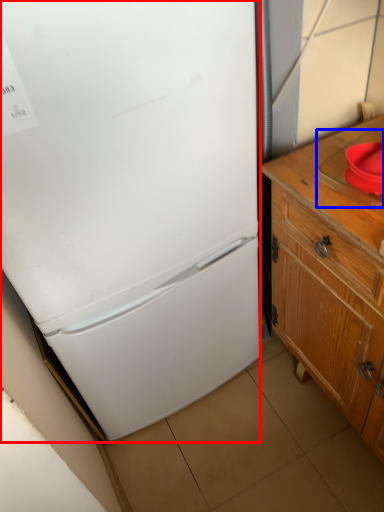
Question: Among these objects, which one is farthest to the camera, refrigerator (highlighted by a red box) or sink (highlighted by a blue box)?

Choices:
 (A) refrigerator
 (B) sink

Answer: (B)